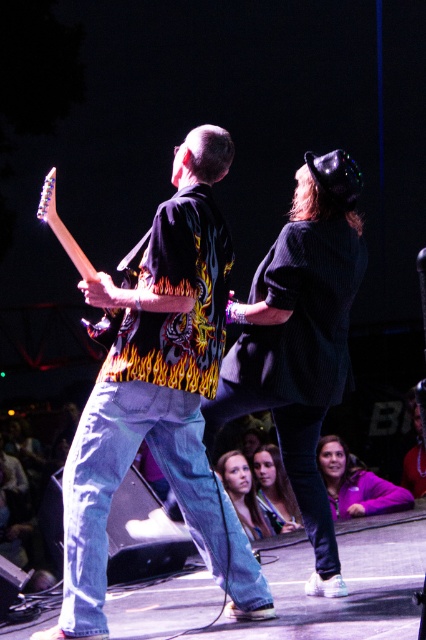
You are a photographer at the back of the venue. You want to take a photo of the smooth skin face at center and the wooden electric guitar at left. Which object is closer to the left side of your camera frame?

The wooden electric guitar at left is to the left of smooth skin face at center, so the wooden electric guitar at left is closer to the left side of your camera frame.

You are a photographer at the back of the venue trying to capture a clear shot of both the wooden electric guitar at left and the smooth skin face at center. Which object should you focus on first to ensure it appears sharp in the photo?

The wooden electric guitar at left is closer to the viewer than the smooth skin face at center, so you should focus on the wooden electric guitar at left first to ensure it appears sharp in the photo.

You are a photographer at the back of the venue and want to capture a clear shot of the wooden electric guitar at left. The camera you have can only focus on objects within a 0.15 unit radius around point (63, 228). Will the guitar be in focus?

The wooden electric guitar at left is exactly at point (63, 228), so yes, it will be in focus since the focus radius is 0.15 units around that point.